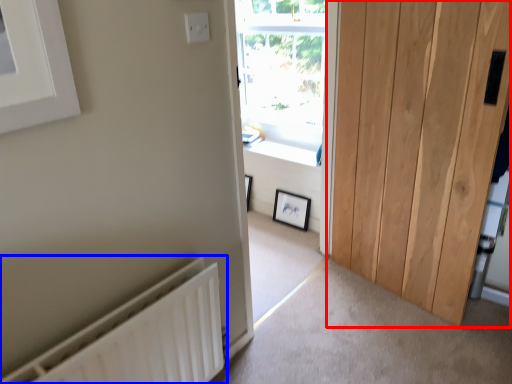
Question: Which object is closer to the camera taking this photo, door (highlighted by a red box) or radiator (highlighted by a blue box)?

Choices:
 (A) door
 (B) radiator

Answer: (B)